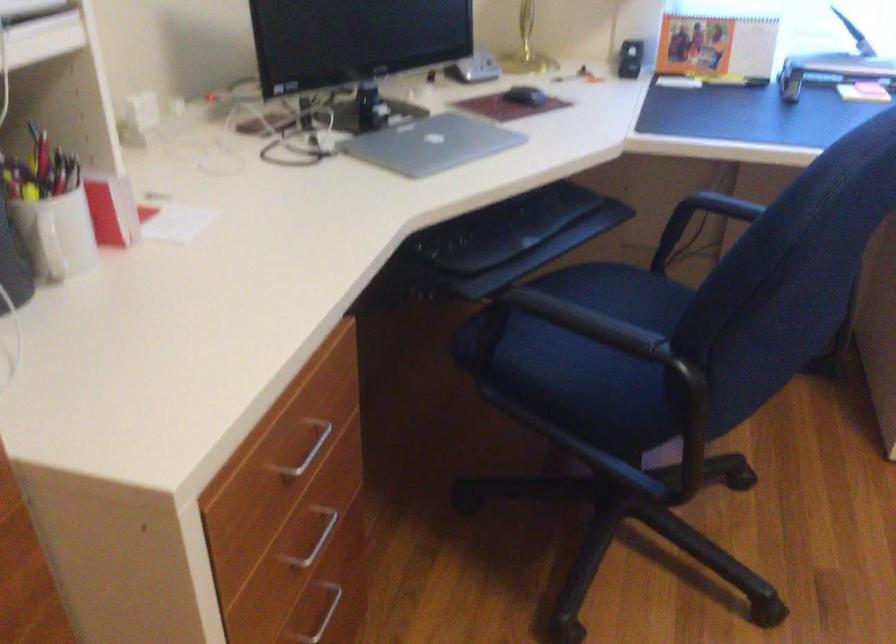
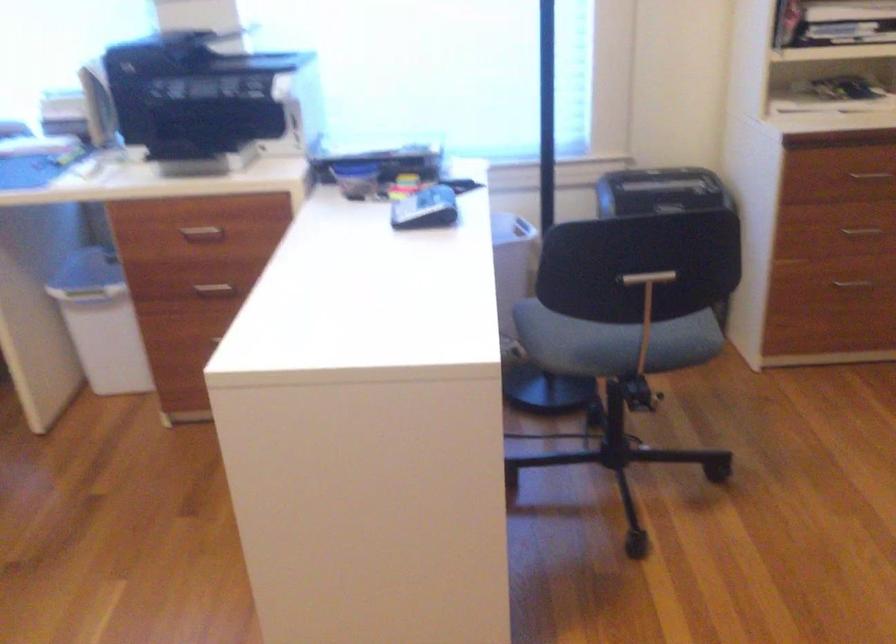
The images are taken continuously from a first-person perspective. In which direction are you moving?

The cameraman moved toward right, backward.